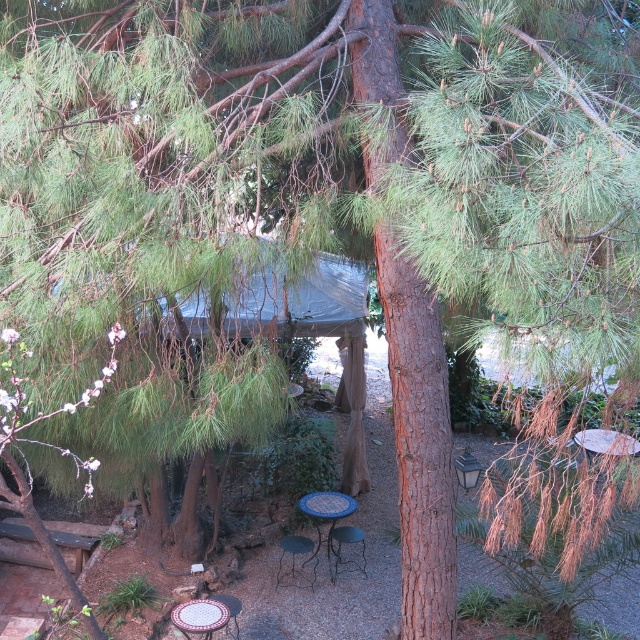
You are planning to place a large potted plant in the garden. You have two options for placement spots near the metallic mesh chair at center and the mosaic tile chair at lower center. Considering their sizes, which chair area can accommodate a larger plant?

The metallic mesh chair at center is bigger than the mosaic tile chair at lower center, so the area around the metallic mesh chair at center can accommodate a larger plant.

You are a gardener planning to place a new potted plant between the metallic mesh chair at center and the mosaic tile chair at lower center. Based on their positions, which chair should the plant be closer to?

The metallic mesh chair at center is located above the mosaic tile chair at lower center, so the plant should be placed closer to the mosaic tile chair at lower center since it is positioned lower.

You are standing at the point with coordinates point [337,513] and want to walk towards the pine tree trunk. Will the point with coordinates point [339,566] block your path?

Point [339,566] is behind point [337,513], so it will not block your path to the pine tree trunk.